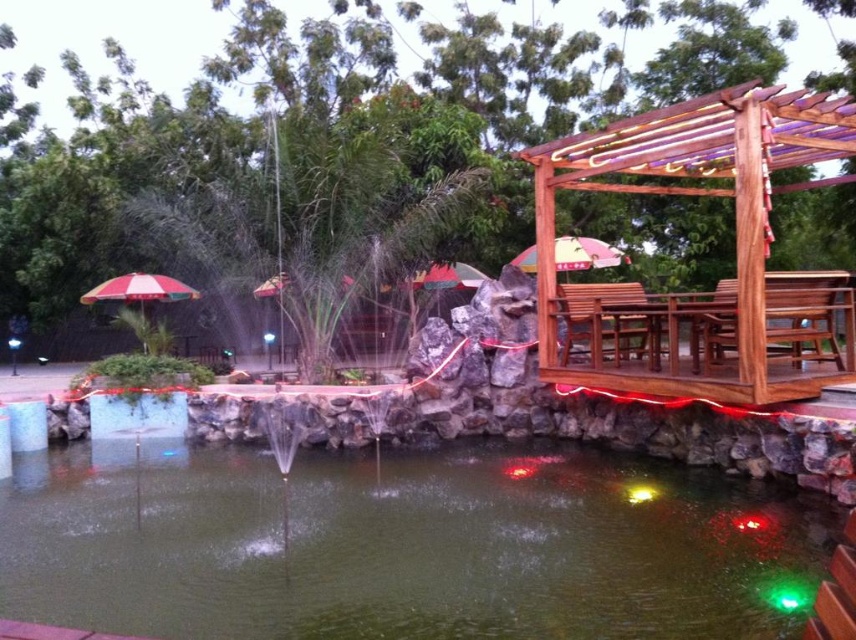
Which is in front, point (643, 577) or point (557, 253)?

Positioned in front is point (643, 577).

In the scene shown: How far apart are green liquid water at center and multicolored fabric umbrella at center?

A distance of 23.55 feet exists between green liquid water at center and multicolored fabric umbrella at center.

Which is behind, point (528, 582) or point (568, 253)?

The point (568, 253) is more distant.

Where is `green liquid water at center`? This screenshot has height=640, width=856. green liquid water at center is located at coordinates (405, 545).

Is green liquid water at center thinner than wooden pergola at right?

No.

Can you confirm if green liquid water at center is positioned below wooden pergola at right?

Yes, green liquid water at center is below wooden pergola at right.

Measure the distance between green liquid water at center and camera.

green liquid water at center is 4.30 meters from camera.

Identify the location of green liquid water at center. (405, 545).

Can you confirm if green liquid water at center is wider than red and white striped umbrella at left?

Correct, the width of green liquid water at center exceeds that of red and white striped umbrella at left.

This screenshot has width=856, height=640. Describe the element at coordinates (405, 545) in the screenshot. I see `green liquid water at center` at that location.

Where is `green liquid water at center`? Image resolution: width=856 pixels, height=640 pixels. green liquid water at center is located at coordinates (405, 545).